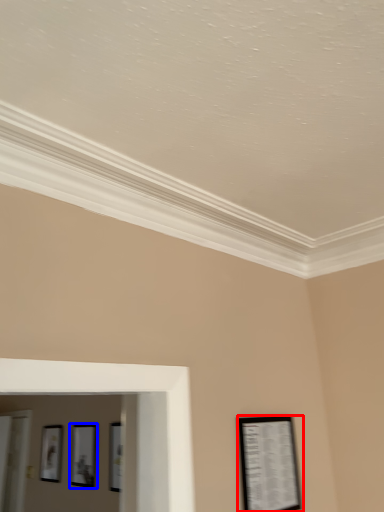
Question: Which object appears farthest to the camera in this image, picture frame (highlighted by a red box) or picture frame (highlighted by a blue box)?

Choices:
 (A) picture frame
 (B) picture frame

Answer: (B)